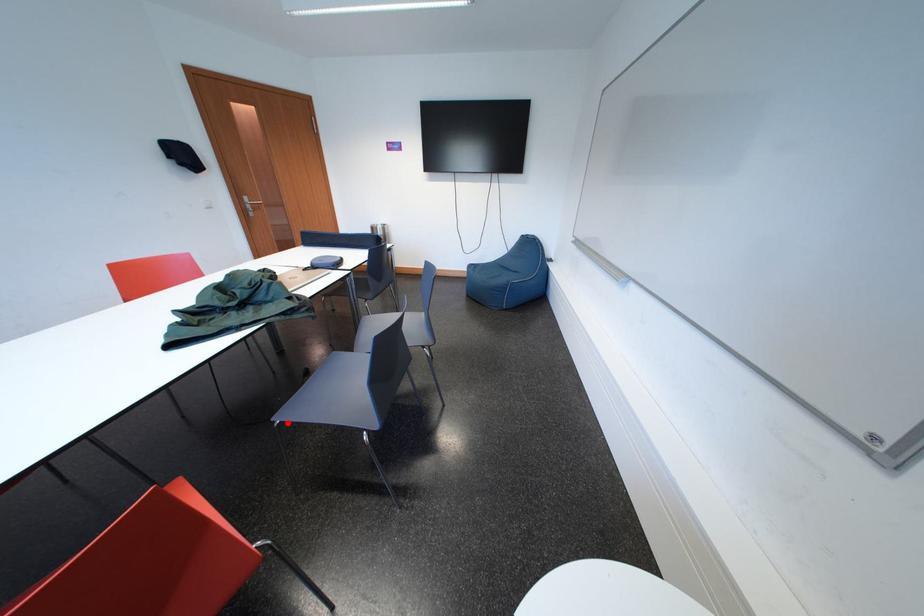
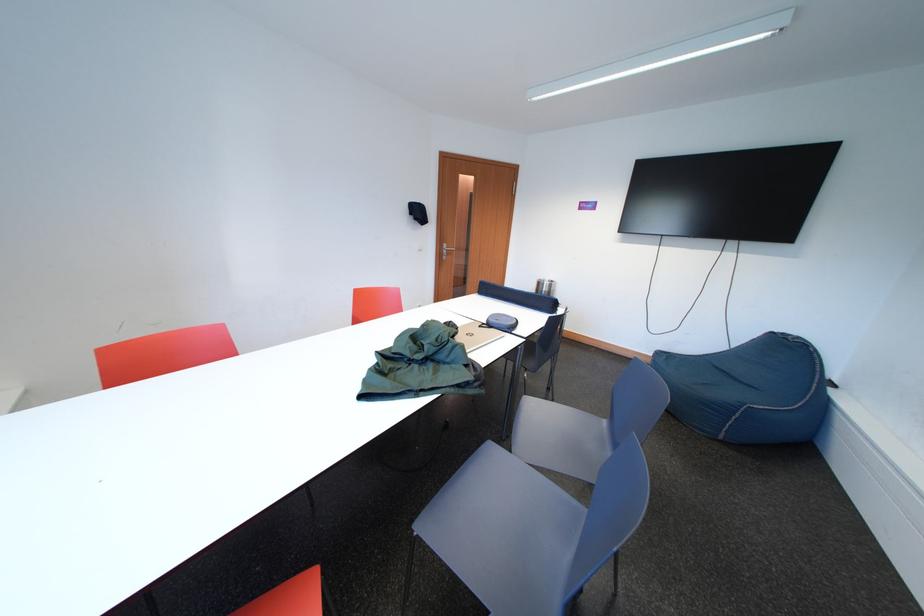
Question: I am providing you with two images of the same scene from different viewpoints. Image1 has a red point marked. In image2, the corresponding 3D location appears at what relative position? Reply with the corresponding letter.

Choices:
 (A) Closer
 (B) Farther

Answer: (B)